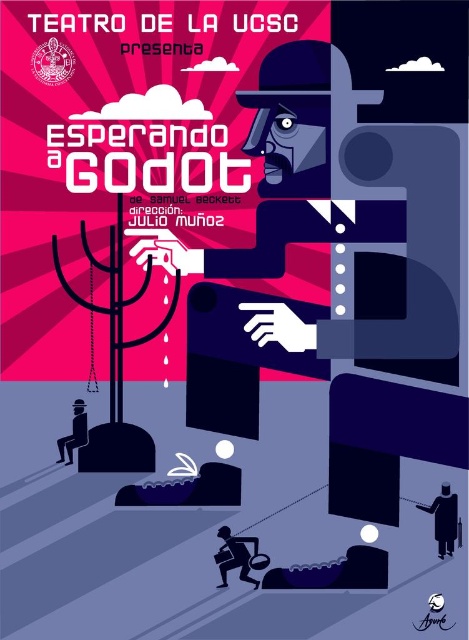
Question: Can you confirm if black matte person at lower right is bigger than silhouette paper bag at lower center?

Choices:
 (A) no
 (B) yes

Answer: (B)

Question: Can you confirm if silhouette paper bag at lower center is positioned to the right of matte black suit at lower left?

Choices:
 (A) no
 (B) yes

Answer: (B)

Question: Among these points, which one is nearest to the camera?

Choices:
 (A) (433, 502)
 (B) (235, 552)
 (C) (66, 435)

Answer: (A)

Question: Can you confirm if black matte person at lower right is positioned below matte black suit at lower left?

Choices:
 (A) no
 (B) yes

Answer: (B)

Question: Which point appears farthest from the camera in this image?

Choices:
 (A) (67, 461)
 (B) (228, 552)

Answer: (A)

Question: Which object is positioned farthest from the silhouette paper bag at lower center?

Choices:
 (A) black matte person at lower right
 (B) matte black suit at lower left

Answer: (B)